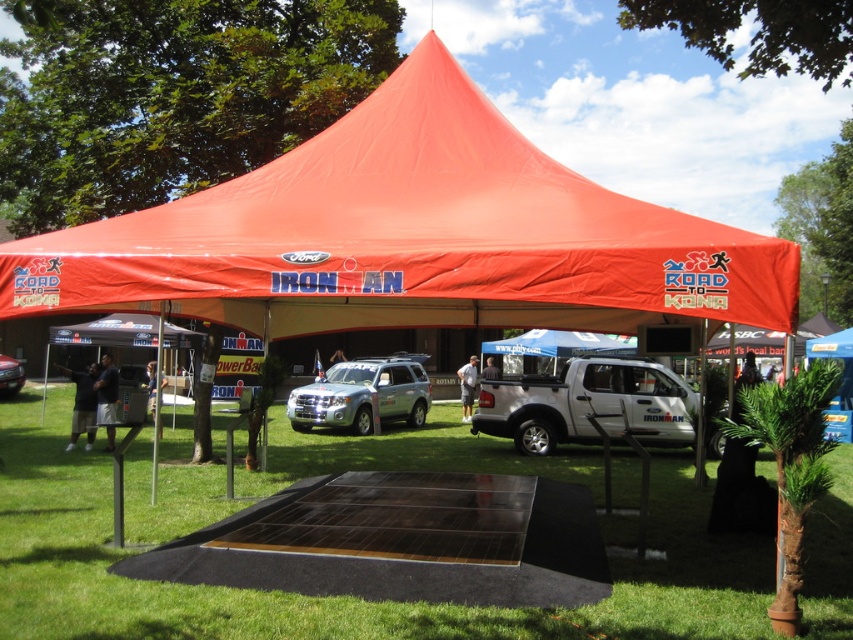
Is white matte truck at center smaller than silver metallic suv at center?

No.

Image resolution: width=853 pixels, height=640 pixels. What do you see at coordinates (589, 404) in the screenshot?
I see `white matte truck at center` at bounding box center [589, 404].

Is point (664, 433) less distant than point (363, 365)?

Yes, it is in front of point (363, 365).

This screenshot has height=640, width=853. In order to click on white matte truck at center in this screenshot , I will do `click(589, 404)`.

Which is more to the right, green grass at lower center or white matte truck at center?

white matte truck at center

Is green grass at lower center behind white matte truck at center?

No.

Is point (706, 620) closer to camera compared to point (618, 371)?

Yes, it is.

At what (x,y) coordinates should I click in order to perform the action: click on green grass at lower center. Please return your answer as a coordinate pair (x, y). This screenshot has width=853, height=640. Looking at the image, I should click on (339, 596).

Who is more distant from viewer, (495,388) or (0,392)?

Point (0,392)

Which is below, white matte truck at center or metallic silver suv at center?

metallic silver suv at center is below.

Describe the element at coordinates (589, 404) in the screenshot. I see `white matte truck at center` at that location.

I want to click on white matte truck at center, so click(x=589, y=404).